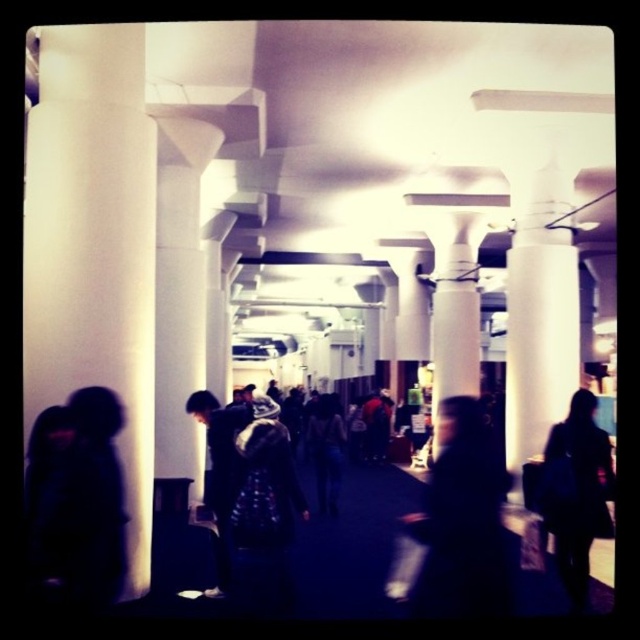
You are standing in the corridor and want to hang a coat on the dark blue textured coat at center. However, there is a white smooth column at left blocking your path. Can you walk around the column to reach the coat?

The white smooth column at left is in front of the dark blue textured coat at center, so you can walk around the column to reach the coat.

You are standing at the entrance of the corridor and need to locate the white smooth column at left. According to the coordinate system where the entrance is at the origin, can you determine its exact position?

The white smooth column at left is located at the coordinate point of [93,244].